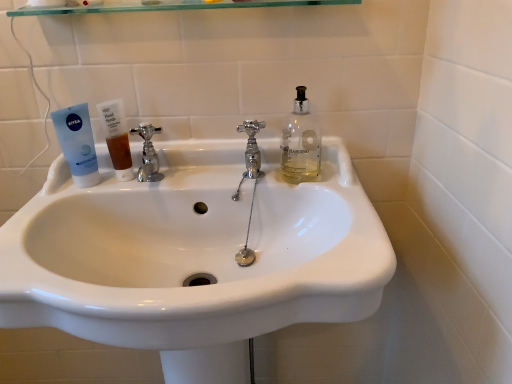
Question: Does transparent glass shelf at upper center have a lesser width compared to chrome metallic faucet at center left, the first tap positioned from the left?

Choices:
 (A) no
 (B) yes

Answer: (A)

Question: Is transparent glass shelf at upper center shorter than chrome metallic faucet at center left, placed as the second tap when sorted from right to left?

Choices:
 (A) yes
 (B) no

Answer: (A)

Question: Considering the relative sizes of transparent glass shelf at upper center and chrome metallic faucet at center left, placed as the second tap when sorted from right to left, in the image provided, is transparent glass shelf at upper center smaller than chrome metallic faucet at center left, placed as the second tap when sorted from right to left,?

Choices:
 (A) yes
 (B) no

Answer: (B)

Question: From a real-world perspective, does transparent glass shelf at upper center stand above chrome metallic faucet at center left, placed as the second tap when sorted from right to left?

Choices:
 (A) yes
 (B) no

Answer: (A)

Question: Does transparent glass shelf at upper center come in front of chrome metallic faucet at center left, placed as the second tap when sorted from right to left?

Choices:
 (A) yes
 (B) no

Answer: (A)

Question: Is chrome metallic faucet at center left, placed as the second tap when sorted from right to left, inside or outside of chrome/metallic faucet at center, the first tap in the right-to-left sequence?

Choices:
 (A) inside
 (B) outside

Answer: (B)

Question: Is chrome metallic faucet at center left, the first tap positioned from the left, taller or shorter than chrome/metallic faucet at center, the first tap in the right-to-left sequence?

Choices:
 (A) short
 (B) tall

Answer: (A)

Question: Relative to chrome/metallic faucet at center, the second tap when ordered from left to right, is chrome metallic faucet at center left, the first tap positioned from the left, in front or behind?

Choices:
 (A) behind
 (B) front

Answer: (A)

Question: In the image, is chrome metallic faucet at center left, placed as the second tap when sorted from right to left, on the left side or the right side of chrome/metallic faucet at center, the second tap when ordered from left to right?

Choices:
 (A) right
 (B) left

Answer: (B)

Question: From the image's perspective, is white glossy sink at center above or below translucent amber liquid at sink left?

Choices:
 (A) above
 (B) below

Answer: (B)

Question: From a real-world perspective, relative to translucent amber liquid at sink left, is white glossy sink at center vertically above or below?

Choices:
 (A) below
 (B) above

Answer: (A)

Question: From their relative heights in the image, would you say white glossy sink at center is taller or shorter than translucent amber liquid at sink left?

Choices:
 (A) tall
 (B) short

Answer: (A)

Question: Considering the positions of white glossy sink at center and translucent amber liquid at sink left in the image, is white glossy sink at center bigger or smaller than translucent amber liquid at sink left?

Choices:
 (A) small
 (B) big

Answer: (B)

Question: Is white glossy sink at center bigger or smaller than chrome metallic faucet at center left, the first tap positioned from the left?

Choices:
 (A) big
 (B) small

Answer: (A)

Question: Does point (265, 317) appear closer or farther from the camera than point (144, 130)?

Choices:
 (A) closer
 (B) farther

Answer: (A)